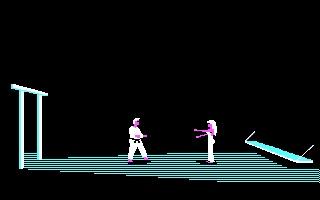
Where is `archway`? This screenshot has width=320, height=200. archway is located at coordinates (39, 99).